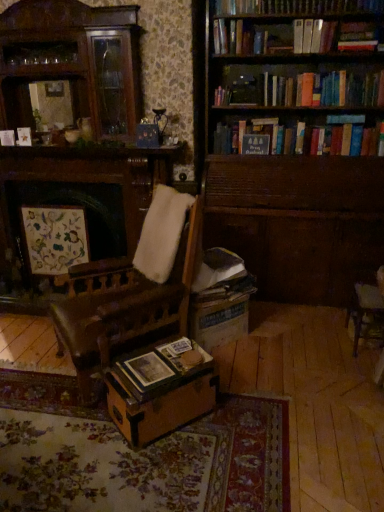
Identify the location of free spot in front of wooden trunk at center. The image size is (384, 512). (166, 472).